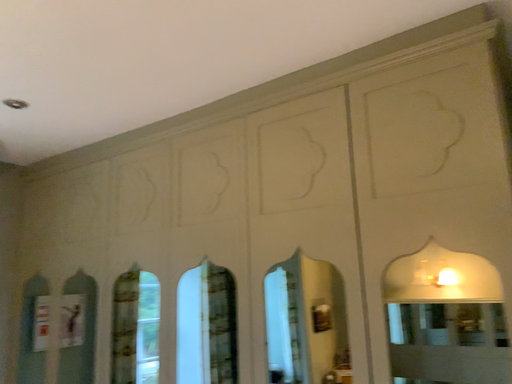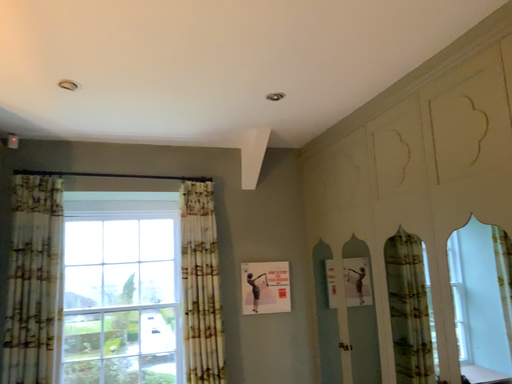
Question: How did the camera likely rotate when shooting the video?

Choices:
 (A) rotated downward
 (B) rotated upward

Answer: (A)